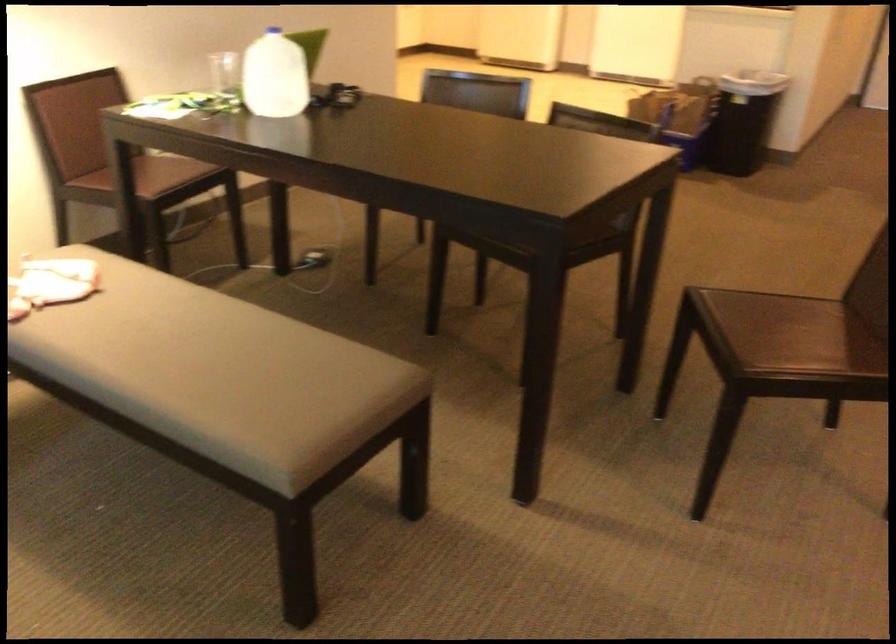
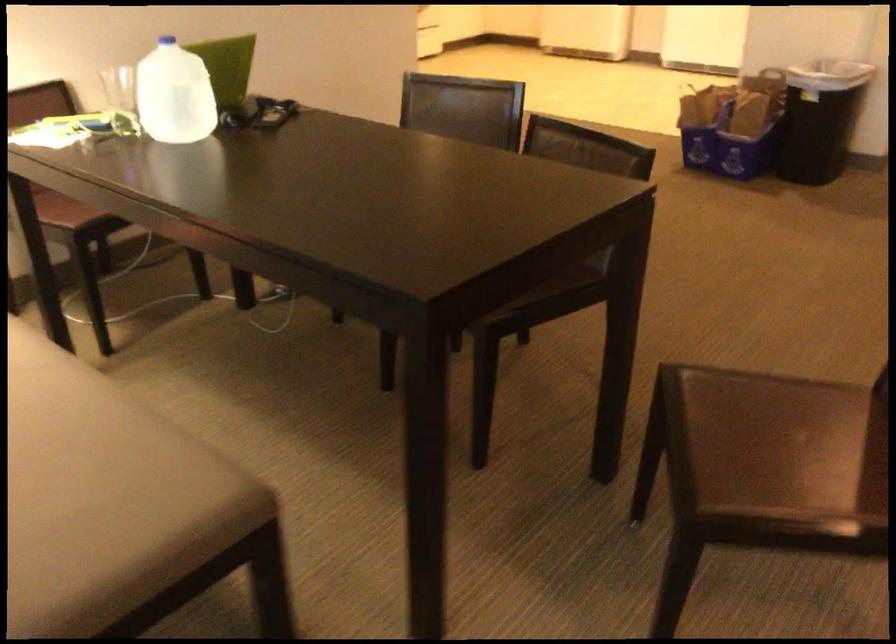
Find the pixel in the second image that matches (244,350) in the first image.

(56, 451)